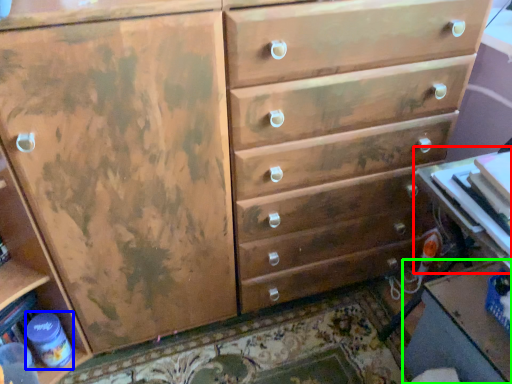
Question: Considering the real-world distances, which object is closest to table (highlighted by a red box)? bottle (highlighted by a blue box) or table (highlighted by a green box).

Choices:
 (A) bottle
 (B) table

Answer: (B)